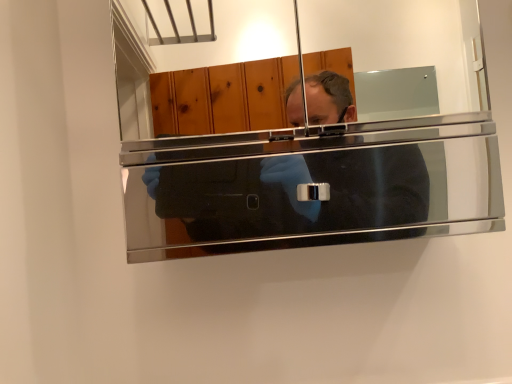
The height and width of the screenshot is (384, 512). What do you see at coordinates (305, 164) in the screenshot?
I see `polished stainless steel mirror at center` at bounding box center [305, 164].

I want to click on polished stainless steel mirror at center, so click(305, 164).

You are a GUI agent. You are given a task and a screenshot of the screen. Output one action in this format:
    pyautogui.click(x=<x>, y=<y>)
    Task: Click on the polished stainless steel mirror at center
    
    Given the screenshot: What is the action you would take?
    305,164